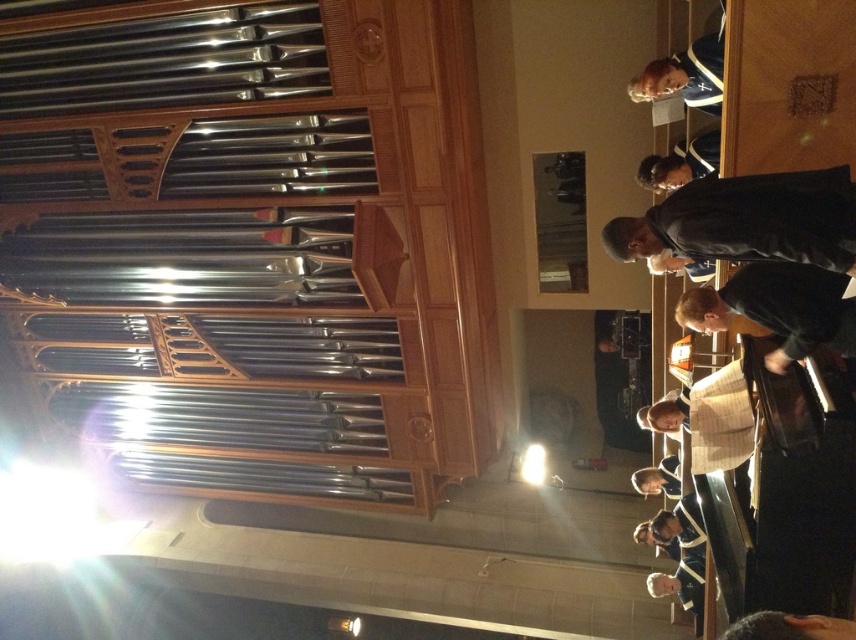
You are a stagehand in this venue and need to adjust the lighting for the conductor. The black matte conductor at lower right is standing behind the organ. Can you see the black matte jacket at upper right from the conductor position?

The black matte jacket at upper right is positioned over the black matte conductor at lower right, so yes, the conductor can see the jacket above them.

You are an event planner setting up for a concert. You need to decide where to place a 1.8 meter tall statue. The statue must be placed so it doesn not block the view of the black matte jacket at upper right and the black matte conductor at lower right. Considering their heights, which object should the statue be placed behind?

The statue should be placed behind the black matte conductor at lower right because the black matte jacket at upper right is not as tall as the black matte conductor at lower right, so placing the statue behind the taller conductor ensures it won not block the view of the shorter jacket.

You are standing in the church and see the black matte conductor at lower right and the blue fabric at upper center. Which object is positioned to the east of the other?

The black matte conductor at lower right is to the right of blue fabric at upper center, so it is positioned to the east of the blue fabric at upper center.